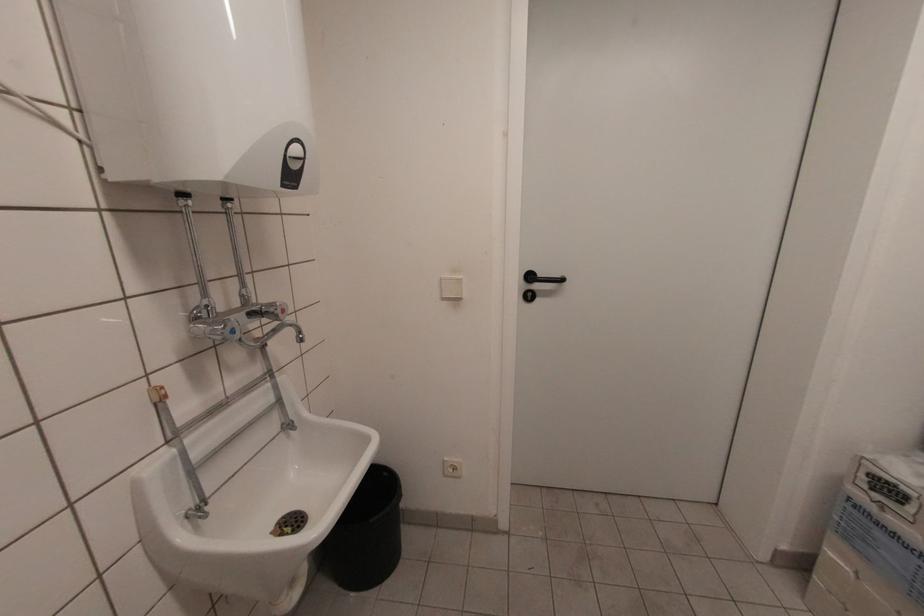
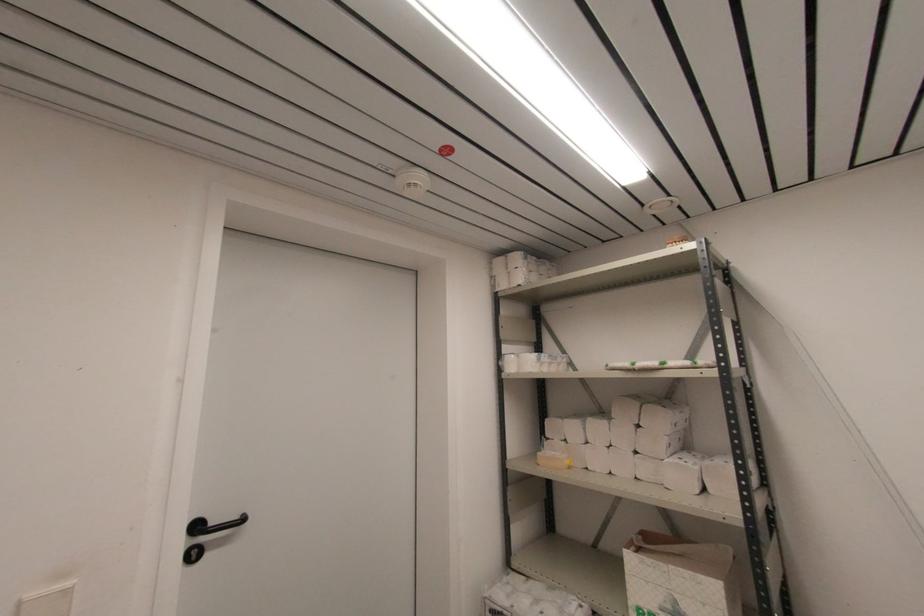
Based on the continuous images, in which direction is the camera rotating?

The camera rotated toward right-up.